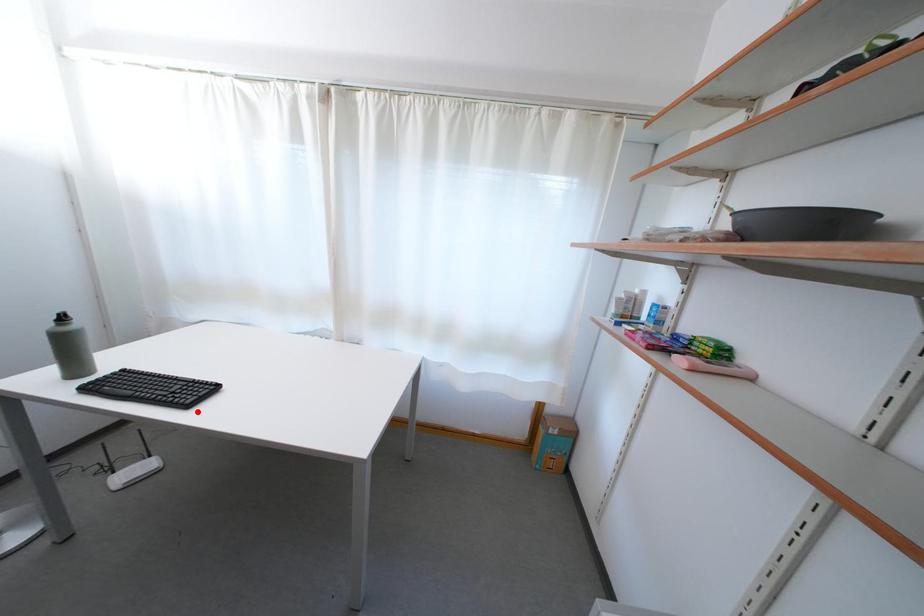
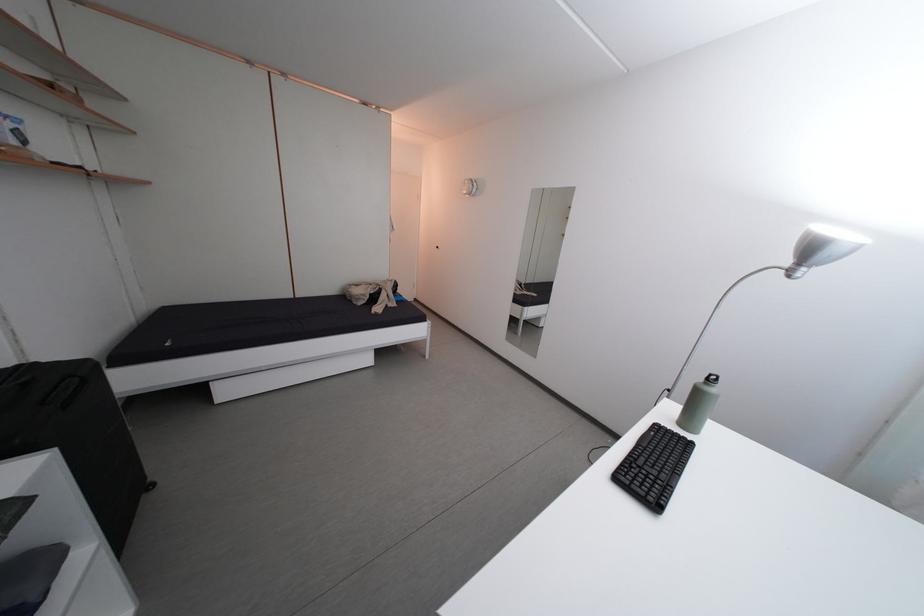
The point at the highlighted location is marked in the first image. Where is the corresponding point in the second image?

(626, 485)